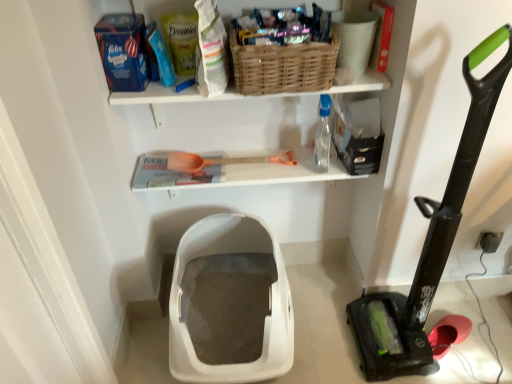
This screenshot has height=384, width=512. Describe the element at coordinates (358, 135) in the screenshot. I see `black matte storage box at upper right, marked as the 1th storage box in a top-to-bottom arrangement` at that location.

This screenshot has height=384, width=512. What are the coordinates of `woven brown basket at upper center` in the screenshot? It's located at (283, 66).

Identify the location of black rubber vacuum at right. (433, 234).

This screenshot has height=384, width=512. I want to click on black matte storage box at upper right, which ranks as the second storage box in bottom-to-top order, so click(358, 135).

Between black rubber vacuum at right and white plastic litter box at center, which is the second storage box in right-to-left order, which one has larger width?

With larger width is white plastic litter box at center, which is the second storage box in right-to-left order.

From the image's perspective, which one is positioned lower, black rubber vacuum at right or white plastic litter box at center, which is the first storage box from bottom to top?

From the image's view, white plastic litter box at center, which is the first storage box from bottom to top, is below.

In the scene shown: Which is behind, black rubber vacuum at right or white plastic litter box at center, positioned as the first storage box in left-to-right order?

white plastic litter box at center, positioned as the first storage box in left-to-right order, is further away from the camera.

Can we say black rubber vacuum at right lies outside white plastic litter box at center, which is the second storage box in right-to-left order?

Yes.

Is orange plastic shovel at center facing towards black rubber vacuum at right?

No, orange plastic shovel at center is not oriented towards black rubber vacuum at right.

Does orange plastic shovel at center have a lesser width compared to black rubber vacuum at right?

Indeed, orange plastic shovel at center has a lesser width compared to black rubber vacuum at right.

Is black rubber vacuum at right a part of orange plastic shovel at center?

Actually, black rubber vacuum at right is outside orange plastic shovel at center.

Which object is more forward, orange plastic shovel at center or black rubber vacuum at right?

Positioned in front is black rubber vacuum at right.

Is the position of orange plastic shovel at center more distant than that of white plastic litter box at center, which is the second storage box in right-to-left order?

Yes, orange plastic shovel at center is further from the camera.

Considering the sizes of objects orange plastic shovel at center and white plastic litter box at center, placed as the second storage box when sorted from top to bottom, in the image provided, who is shorter, orange plastic shovel at center or white plastic litter box at center, placed as the second storage box when sorted from top to bottom,?

orange plastic shovel at center is shorter.

Does point (193, 161) appear closer or farther from the camera than point (256, 284)?

Clearly, point (193, 161) is closer to the camera than point (256, 284).

From a real-world perspective, who is located higher, orange plastic shovel at center or white plastic litter box at center, which is the second storage box in right-to-left order?

orange plastic shovel at center, from a real-world perspective.

This screenshot has height=384, width=512. Find the location of `basket in front of the transparent plastic bottle at upper right`. basket in front of the transparent plastic bottle at upper right is located at coordinates (283, 66).

Do you think transparent plastic bottle at upper right is within woven brown basket at upper center, or outside of it?

transparent plastic bottle at upper right is spatially situated outside woven brown basket at upper center.

Is transparent plastic bottle at upper right further to the viewer compared to woven brown basket at upper center?

That is True.

In terms of height, does transparent plastic bottle at upper right look taller or shorter compared to woven brown basket at upper center?

Clearly, transparent plastic bottle at upper right is taller compared to woven brown basket at upper center.

Considering the points (320, 47) and (362, 127), which point is behind, point (320, 47) or point (362, 127)?

The point (362, 127) is farther from the camera.

Which of these two, woven brown basket at upper center or black matte storage box at upper right, the first storage box in the right-to-left sequence, stands taller?

Standing taller between the two is black matte storage box at upper right, the first storage box in the right-to-left sequence.

Image resolution: width=512 pixels, height=384 pixels. In order to click on basket located in front of the black matte storage box at upper right, which ranks as the second storage box in bottom-to-top order in this screenshot , I will do `click(283, 66)`.

From the image's perspective, is black rubber vacuum at right beneath transparent plastic bottle at upper right?

Yes, from the image's perspective, black rubber vacuum at right is beneath transparent plastic bottle at upper right.

Is transparent plastic bottle at upper right at the back of black rubber vacuum at right?

black rubber vacuum at right does not have its back to transparent plastic bottle at upper right.

Considering the sizes of objects black rubber vacuum at right and transparent plastic bottle at upper right in the image provided, who is wider, black rubber vacuum at right or transparent plastic bottle at upper right?

With larger width is black rubber vacuum at right.

Which is behind, black rubber vacuum at right or transparent plastic bottle at upper right?

transparent plastic bottle at upper right is behind.

Locate an element on the screen. The image size is (512, 384). bottle above the orange plastic shovel at center (from a real-world perspective) is located at coordinates (323, 135).

From a real-world perspective, between transparent plastic bottle at upper right and orange plastic shovel at center, who is vertically higher?

In real-world perspective, transparent plastic bottle at upper right is above.

From the black rubber vacuum at right, count the 2nd storage box to the left and point to it. Please provide its 2D coordinates.

[(230, 303)]

Locate an element on the screen. vacuum that is below the orange plastic shovel at center (from the image's perspective) is located at coordinates (433, 234).

Estimate the real-world distances between objects in this image. Which object is closer to white plastic litter box at center, positioned as the first storage box in left-to-right order, woven brown basket at upper center or black rubber vacuum at right?

Among the two, black rubber vacuum at right is located nearer to white plastic litter box at center, positioned as the first storage box in left-to-right order.

Based on their spatial positions, is white plastic litter box at center, placed as the second storage box when sorted from top to bottom, or orange plastic shovel at center further from woven brown basket at upper center?

Among the two, white plastic litter box at center, placed as the second storage box when sorted from top to bottom, is located further to woven brown basket at upper center.

Based on their spatial positions, is black matte storage box at upper right, the first storage box in the right-to-left sequence, or orange plastic shovel at center closer to black rubber vacuum at right?

black matte storage box at upper right, the first storage box in the right-to-left sequence, lies closer to black rubber vacuum at right than the other object.

Considering their positions, is woven brown basket at upper center positioned further to black matte storage box at upper right, which ranks as the second storage box in bottom-to-top order, than white plastic litter box at center, which is the second storage box in right-to-left order?

white plastic litter box at center, which is the second storage box in right-to-left order, is further to black matte storage box at upper right, which ranks as the second storage box in bottom-to-top order.

Looking at the image, which one is located closer to black matte storage box at upper right, marked as the 1th storage box in a top-to-bottom arrangement, black rubber vacuum at right or orange plastic shovel at center?

orange plastic shovel at center is closer to black matte storage box at upper right, marked as the 1th storage box in a top-to-bottom arrangement.

Considering their positions, is white plastic litter box at center, which is the second storage box in right-to-left order, positioned further to black rubber vacuum at right than orange plastic shovel at center?

orange plastic shovel at center lies further to black rubber vacuum at right than the other object.

From the image, which object appears to be farther from black rubber vacuum at right, black matte storage box at upper right, the 2th storage box viewed from the left, or white plastic litter box at center, which is the second storage box in right-to-left order?

white plastic litter box at center, which is the second storage box in right-to-left order, is positioned further to the anchor black rubber vacuum at right.

Looking at this image, considering their positions, is woven brown basket at upper center positioned further to transparent plastic bottle at upper right than white plastic litter box at center, placed as the second storage box when sorted from top to bottom?

white plastic litter box at center, placed as the second storage box when sorted from top to bottom.

You are a GUI agent. You are given a task and a screenshot of the screen. Output one action in this format:
    pyautogui.click(x=<x>, y=<y>)
    Task: Click on the bottle between black matte storage box at upper right, the 2th storage box viewed from the left, and white plastic litter box at center, which is the second storage box in right-to-left order, vertically
    This screenshot has width=512, height=384.
    Given the screenshot: What is the action you would take?
    pyautogui.click(x=323, y=135)

Identify the location of basket positioned between black rubber vacuum at right and orange plastic shovel at center from near to far. The image size is (512, 384). point(283,66).

At what (x,y) coordinates should I click in order to perform the action: click on bottle positioned between black rubber vacuum at right and orange plastic shovel at center from near to far. Please return your answer as a coordinate pair (x, y). Looking at the image, I should click on (323, 135).

You are a GUI agent. You are given a task and a screenshot of the screen. Output one action in this format:
    pyautogui.click(x=<x>, y=<y>)
    Task: Click on the bottle between woven brown basket at upper center and black matte storage box at upper right, which ranks as the second storage box in bottom-to-top order, in the horizontal direction
    
    Given the screenshot: What is the action you would take?
    pyautogui.click(x=323, y=135)